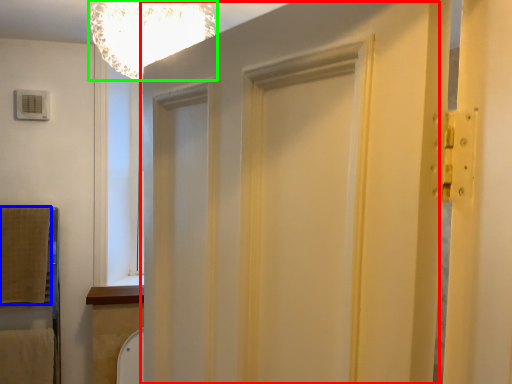
Question: Estimate the real-world distances between objects in this image. Which object is farther from barn door (highlighted by a red box), blanket (highlighted by a blue box) or light fixture (highlighted by a green box)?

Choices:
 (A) blanket
 (B) light fixture

Answer: (A)